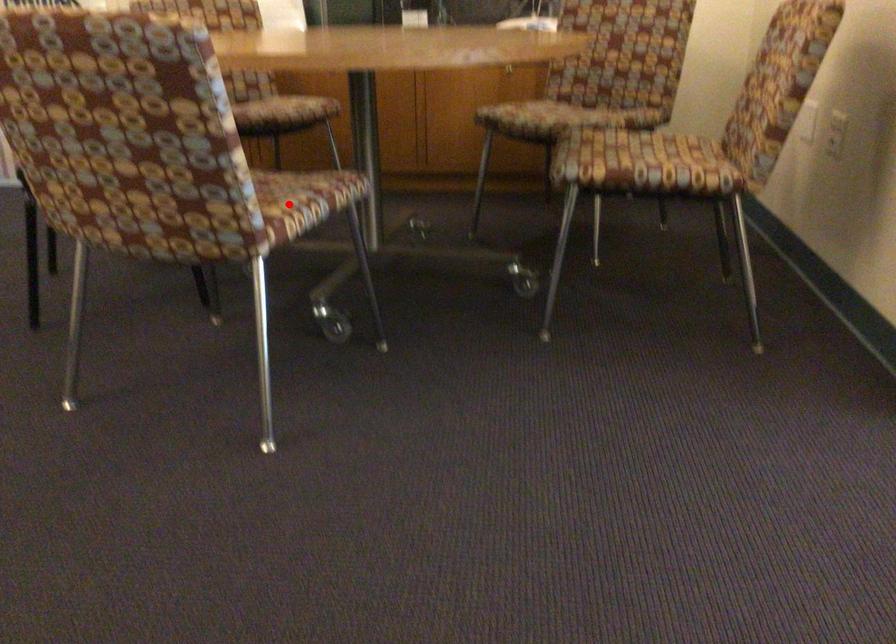
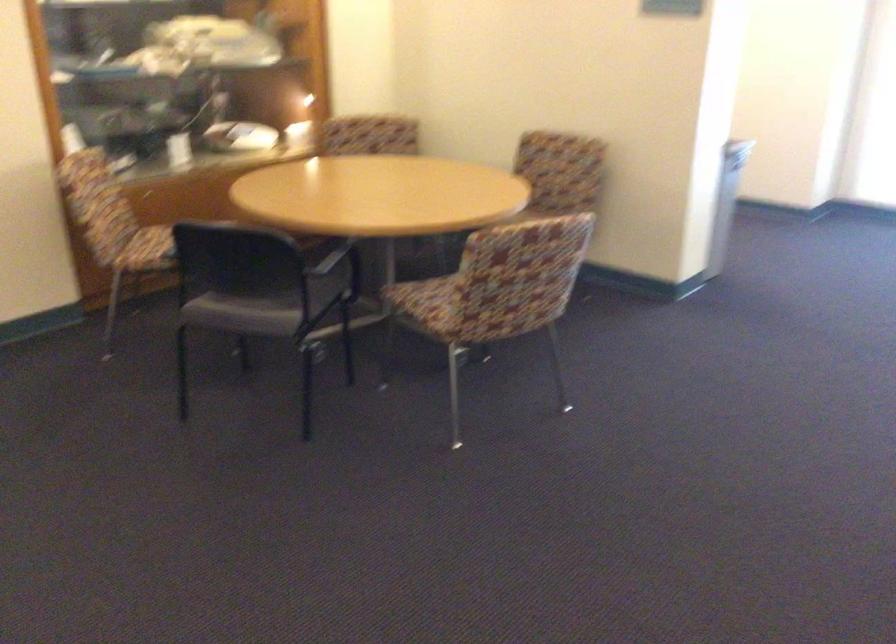
Question: I am providing you with two images of the same scene from different viewpoints. A red point is marked on the first image. Can you still see the location of the red point in image 2?

Choices:
 (A) Yes
 (B) No

Answer: (B)